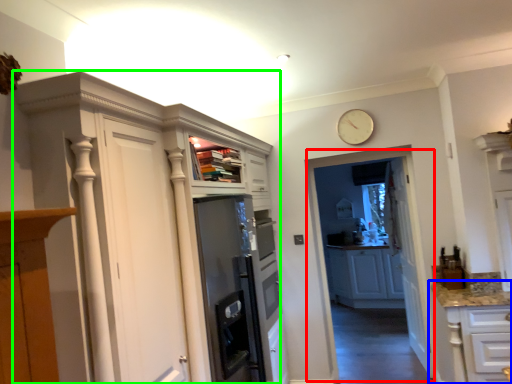
Question: Estimate the real-world distances between objects in this image. Which object is farther from glass door (highlighted by a red box), cabinetry (highlighted by a blue box) or cupboard (highlighted by a green box)?

Choices:
 (A) cabinetry
 (B) cupboard

Answer: (B)